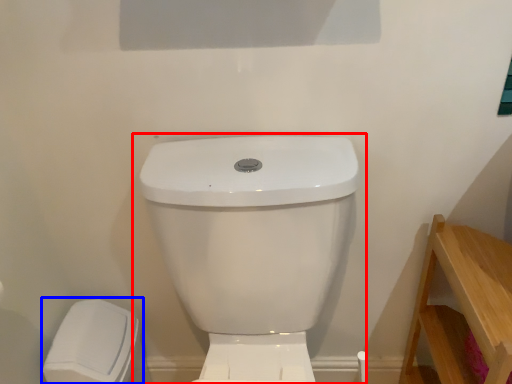
Question: Which object appears farthest to the camera in this image, toilet (highlighted by a red box) or porcelain (highlighted by a blue box)?

Choices:
 (A) toilet
 (B) porcelain

Answer: (B)